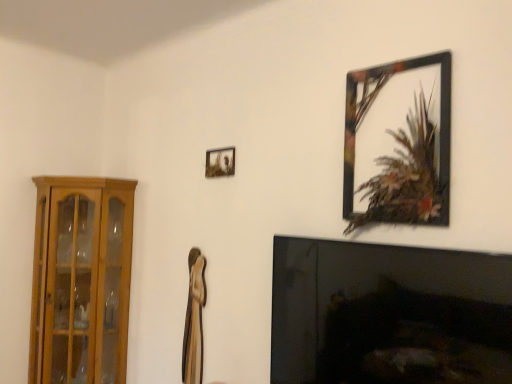
Question: Relative to wooden cabinet at left, is metallic silver photo frame at upper center, which appears as the 2th picture frame when viewed from the right, in front or behind?

Choices:
 (A) front
 (B) behind

Answer: (A)

Question: Considering the positions of point (212, 173) and point (102, 304), is point (212, 173) closer or farther from the camera than point (102, 304)?

Choices:
 (A) closer
 (B) farther

Answer: (A)

Question: Which object is positioned farthest from the black glass fireplace at lower right?

Choices:
 (A) metallic silver photo frame at upper center, the second picture frame viewed from the front
 (B) wooden cabinet at left
 (C) metallic black picture frame at upper right, which is the second picture frame in left-to-right order

Answer: (B)

Question: Which object is positioned farthest from the wooden cabinet at left?

Choices:
 (A) metallic silver photo frame at upper center, the second picture frame viewed from the front
 (B) black glass fireplace at lower right
 (C) metallic black picture frame at upper right, which is the first picture frame in right-to-left order

Answer: (C)